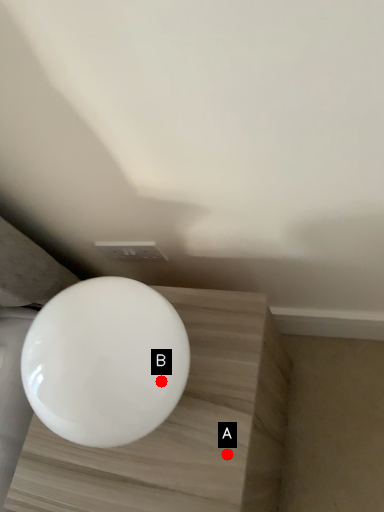
Question: Two points are circled on the image, labeled by A and B beside each circle. Which point is farther from the camera taking this photo?

Choices:
 (A) A is further
 (B) B is further

Answer: (A)